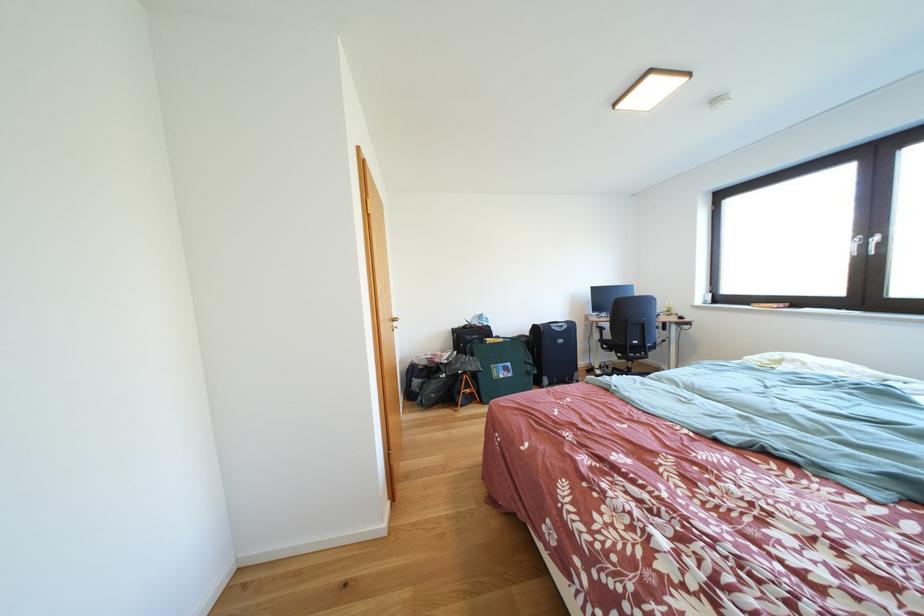
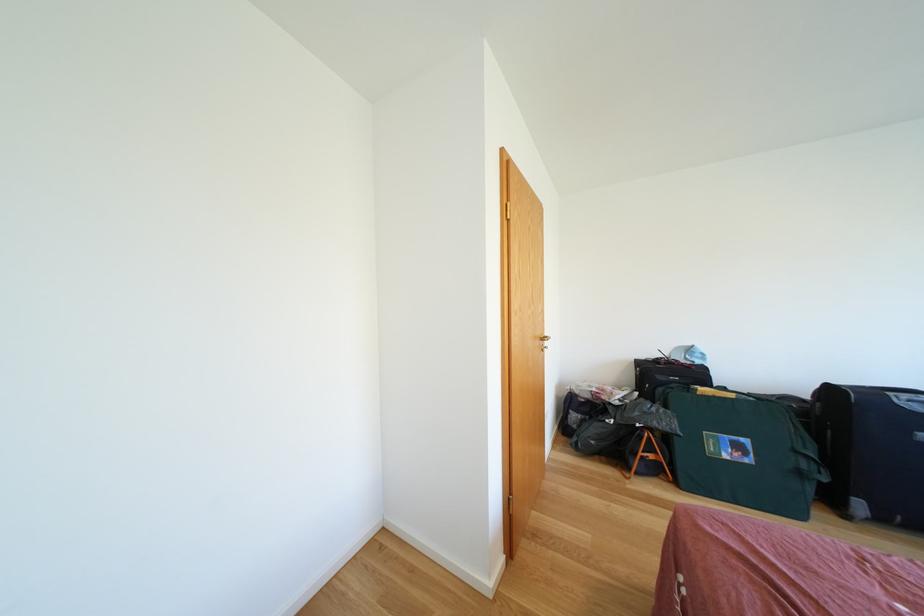
Question: Based on the continuous images, in which direction is the camera rotating? Reply with the corresponding letter.

Choices:
 (A) Left
 (B) Right
 (C) Up
 (D) Down

Answer: (A)